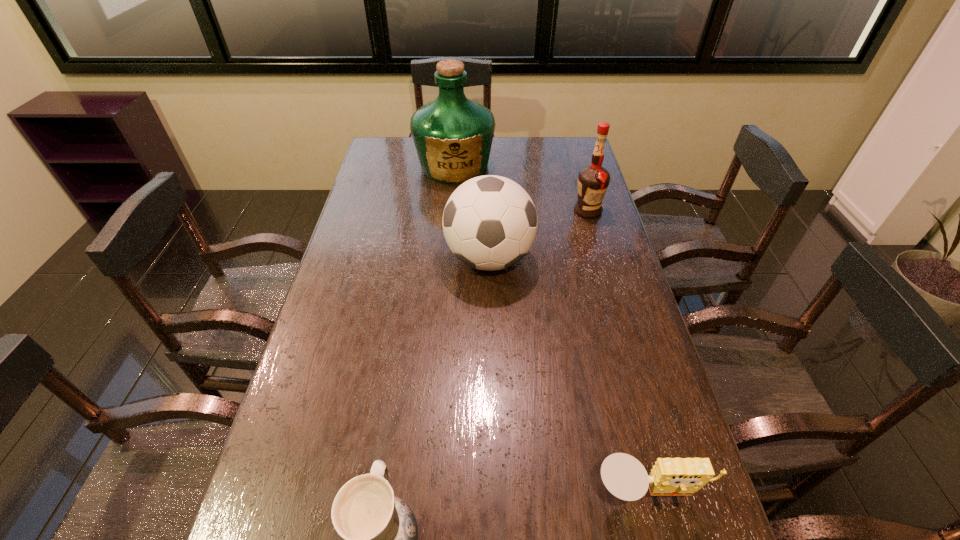
Identify which object is the fourth closest to the soccer ball. Please provide its 2D coordinates. Your answer should be formatted as a tuple, i.e. [(x, y)], where the tuple contains the x and y coordinates of a point satisfying the conditions above.

[(379, 531)]

Where is `free space that satisfies the following two spatial constraints: 1. on the label side of the farthest object; 2. on the left side of the third farthest object`? The width and height of the screenshot is (960, 540). free space that satisfies the following two spatial constraints: 1. on the label side of the farthest object; 2. on the left side of the third farthest object is located at coordinates (447, 259).

Where is `vacant area that satisfies the following two spatial constraints: 1. on the label side of the soccer ball; 2. on the left side of the tallest object`? Image resolution: width=960 pixels, height=540 pixels. vacant area that satisfies the following two spatial constraints: 1. on the label side of the soccer ball; 2. on the left side of the tallest object is located at coordinates (447, 259).

The width and height of the screenshot is (960, 540). What are the coordinates of `free space that satisfies the following two spatial constraints: 1. on the label side of the third tallest object; 2. on the right side of the taller liquor` in the screenshot? It's located at (447, 259).